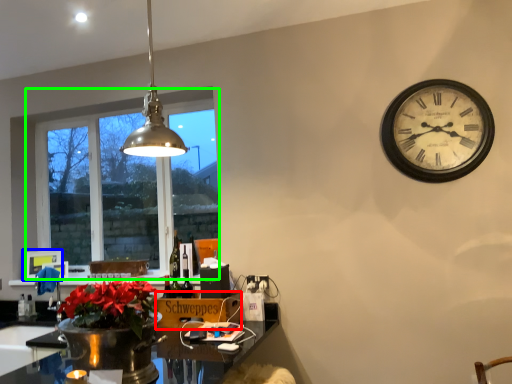
Question: Based on their relative distances, which object is nearer to cardboard box (highlighted by a red box)? Choose from picture frame (highlighted by a blue box) and window (highlighted by a green box).

Choices:
 (A) picture frame
 (B) window

Answer: (B)